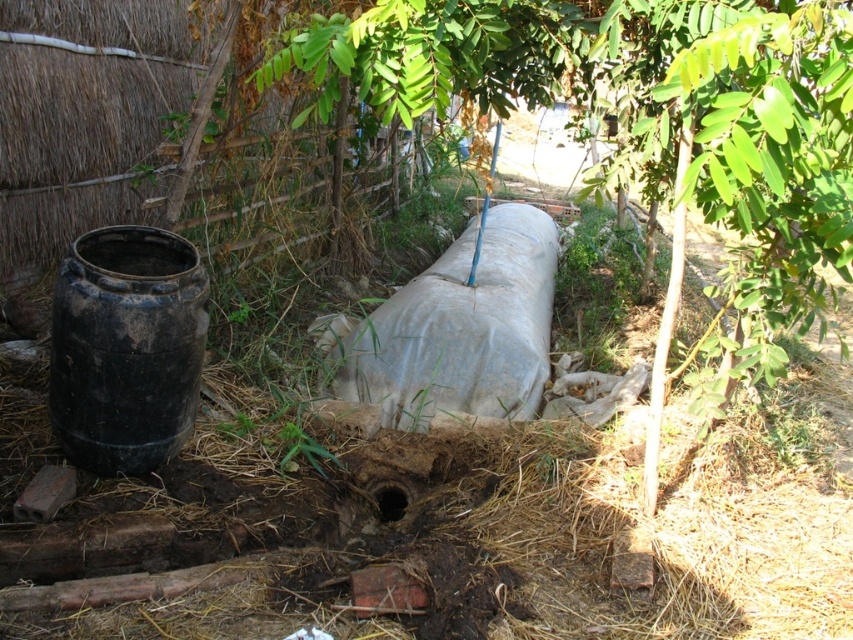
Question: Which object is farther from the camera taking this photo?

Choices:
 (A) gray matte tank at center
 (B) green leafy tree at center

Answer: (A)

Question: Is green leafy tree at center wider than gray matte tank at center?

Choices:
 (A) no
 (B) yes

Answer: (B)

Question: Does green leafy tree at center appear under gray matte tank at center?

Choices:
 (A) no
 (B) yes

Answer: (A)

Question: Is green leafy tree at center to the right of gray matte tank at center from the viewer's perspective?

Choices:
 (A) no
 (B) yes

Answer: (B)